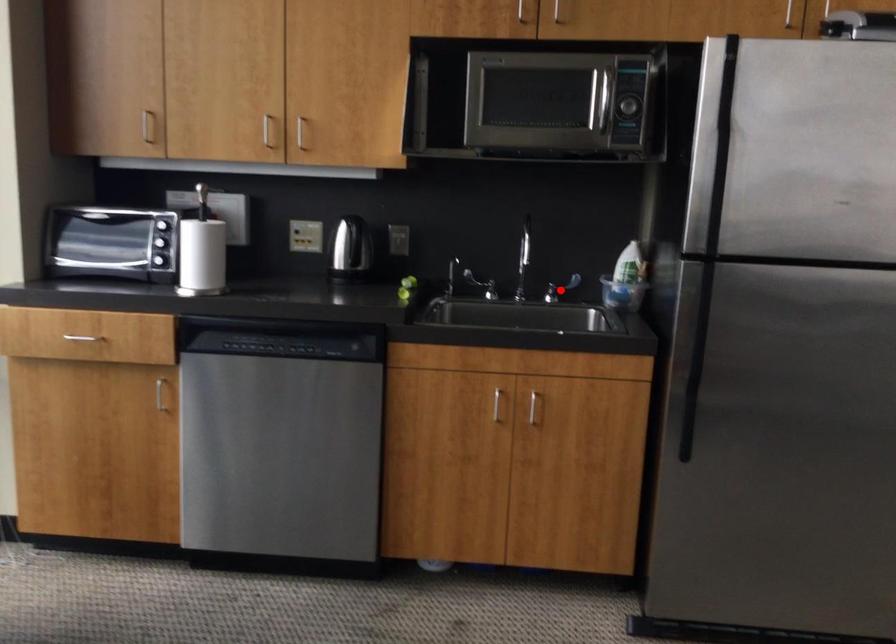
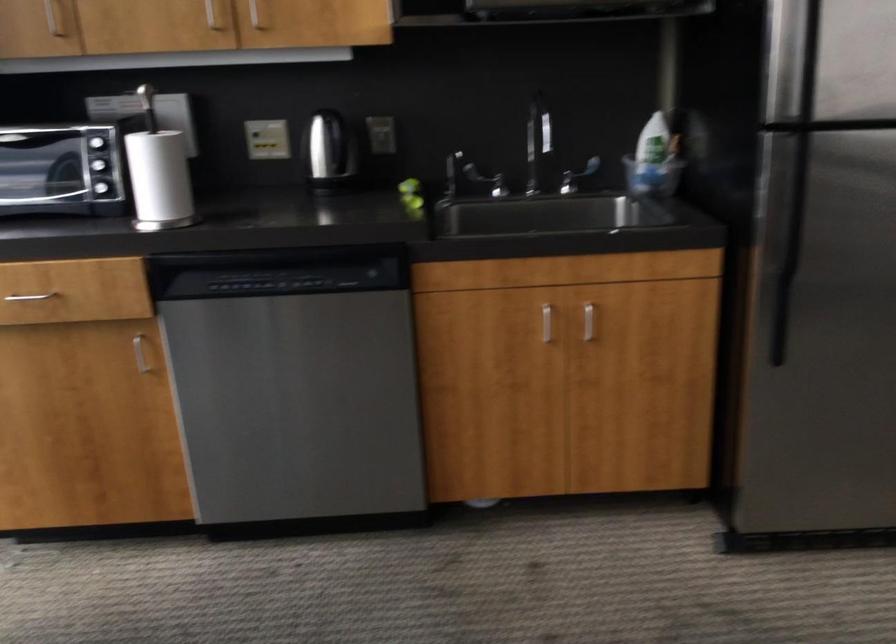
Find the pixel in the second image that matches the highlighted location in the first image.

(576, 176)